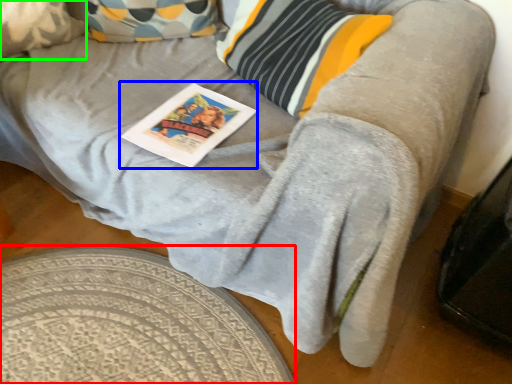
Question: Which object is the closest to the round table (highlighted by a red box)? Choose among these: magazine (highlighted by a blue box) or pillow (highlighted by a green box).

Choices:
 (A) magazine
 (B) pillow

Answer: (A)